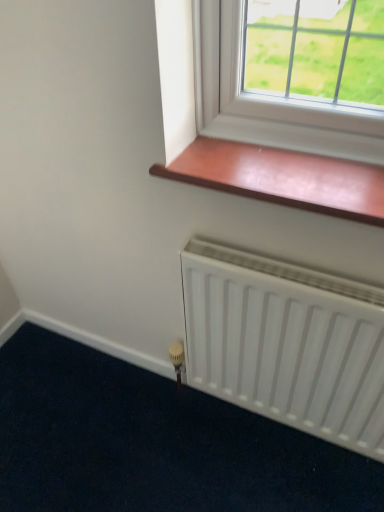
Where is `wooden at upper center`? wooden at upper center is located at coordinates (282, 177).

Describe the element at coordinates (282, 177) in the screenshot. I see `wooden at upper center` at that location.

You are a GUI agent. You are given a task and a screenshot of the screen. Output one action in this format:
    pyautogui.click(x=<x>, y=<y>)
    Task: Click on the wooden at upper center
    The height and width of the screenshot is (512, 384).
    Given the screenshot: What is the action you would take?
    pyautogui.click(x=282, y=177)